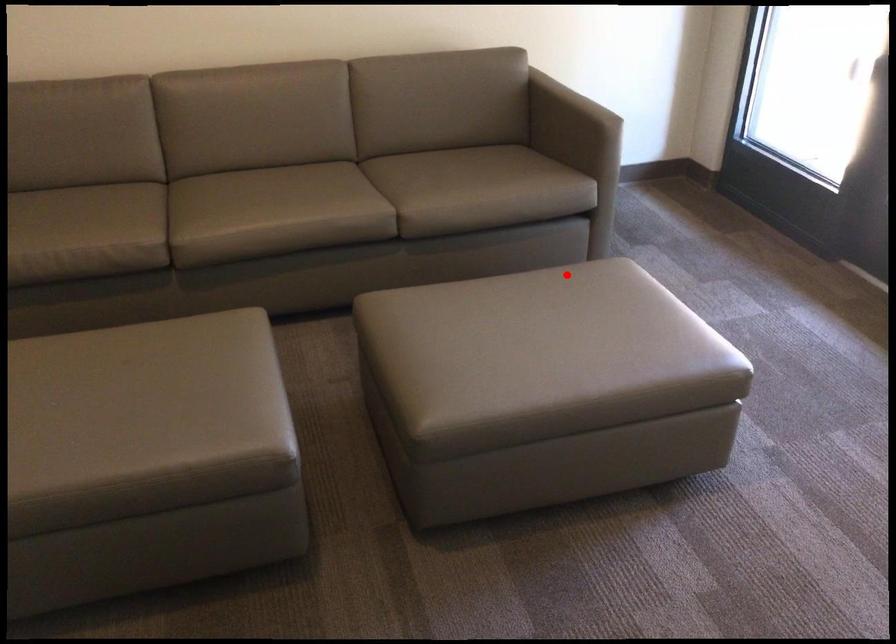
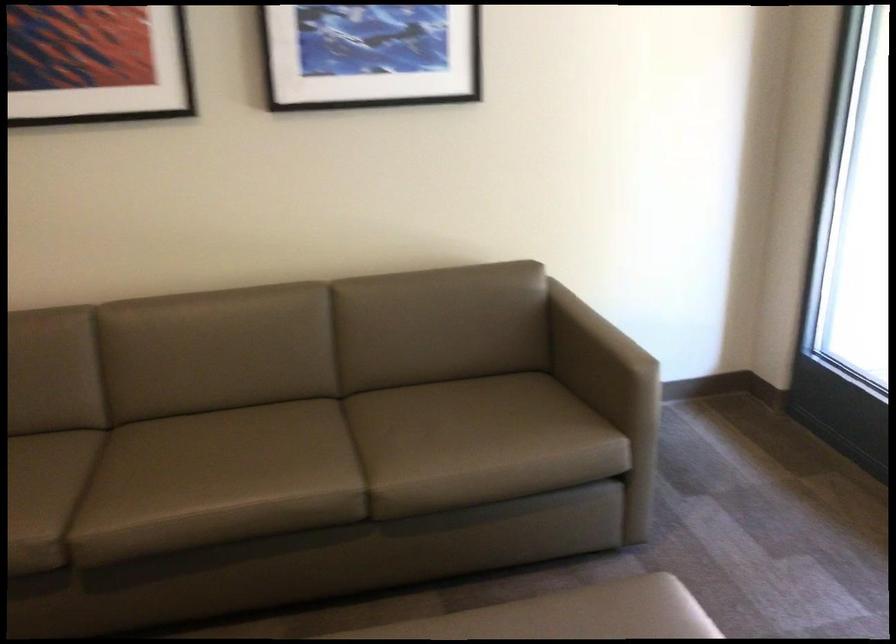
Question: I am providing you with two images of the same scene from different viewpoints. Given a red point in image1, look at the same physical point in image2. Is it:

Choices:
 (A) Closer to the viewpoint
 (B) Farther from the viewpoint

Answer: (A)